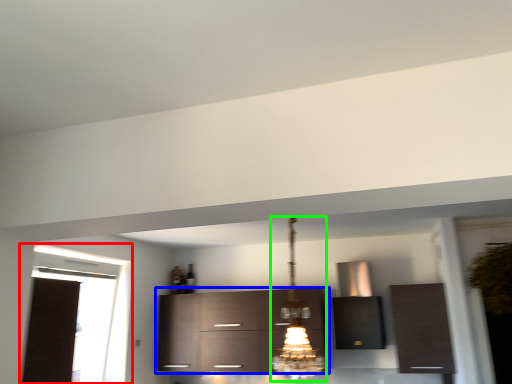
Question: Estimate the real-world distances between objects in this image. Which object is farther from window (highlighted by a red box), cabinetry (highlighted by a blue box) or light fixture (highlighted by a green box)?

Choices:
 (A) cabinetry
 (B) light fixture

Answer: (B)